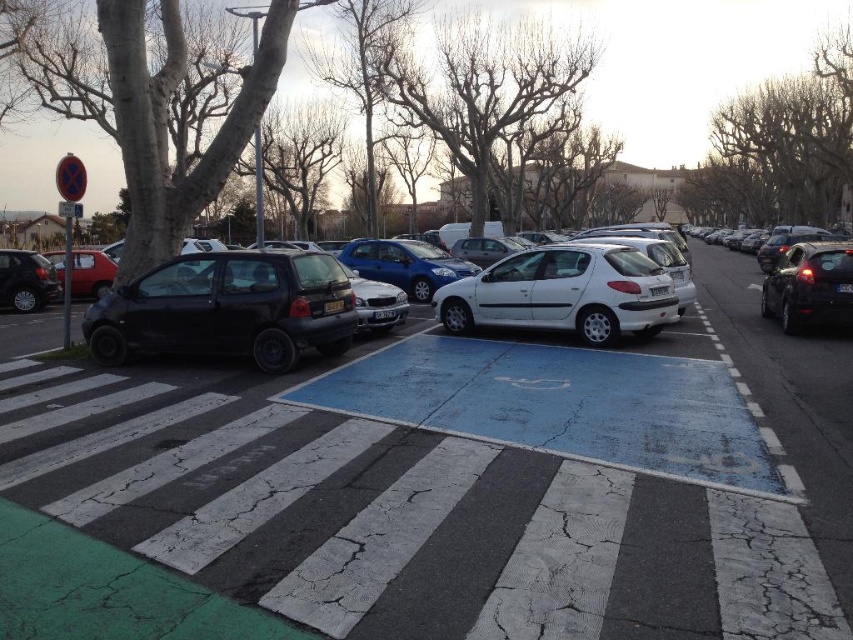
Between white matte car at center and white matte hatchback at center, which one appears on the right side from the viewer's perspective?

white matte hatchback at center

Does white matte car at center lie behind white matte hatchback at center?

No, it is in front of white matte hatchback at center.

The height and width of the screenshot is (640, 853). Describe the element at coordinates (451, 483) in the screenshot. I see `white matte car at center` at that location.

Identify the location of white matte car at center. (451, 483).

Between point (181, 296) and point (798, 253), which one is positioned in front?

Point (181, 296) is in front.

Can you confirm if matte black car at left is positioned to the right of shiny black sedan at right?

No, matte black car at left is not to the right of shiny black sedan at right.

I want to click on matte black car at left, so click(x=228, y=308).

You are a GUI agent. You are given a task and a screenshot of the screen. Output one action in this format:
    pyautogui.click(x=<x>, y=<y>)
    Task: Click on the matte black car at left
    The width and height of the screenshot is (853, 640).
    Given the screenshot: What is the action you would take?
    pyautogui.click(x=228, y=308)

Is white matte hatchback at center positioned behind shiny black car at left?

That is False.

Is white matte hatchback at center thinner than shiny black car at left?

Incorrect, white matte hatchback at center's width is not less than shiny black car at left's.

Find the location of a particular element. white matte hatchback at center is located at coordinates (563, 292).

Where is `white matte hatchback at center`? Image resolution: width=853 pixels, height=640 pixels. white matte hatchback at center is located at coordinates (563, 292).